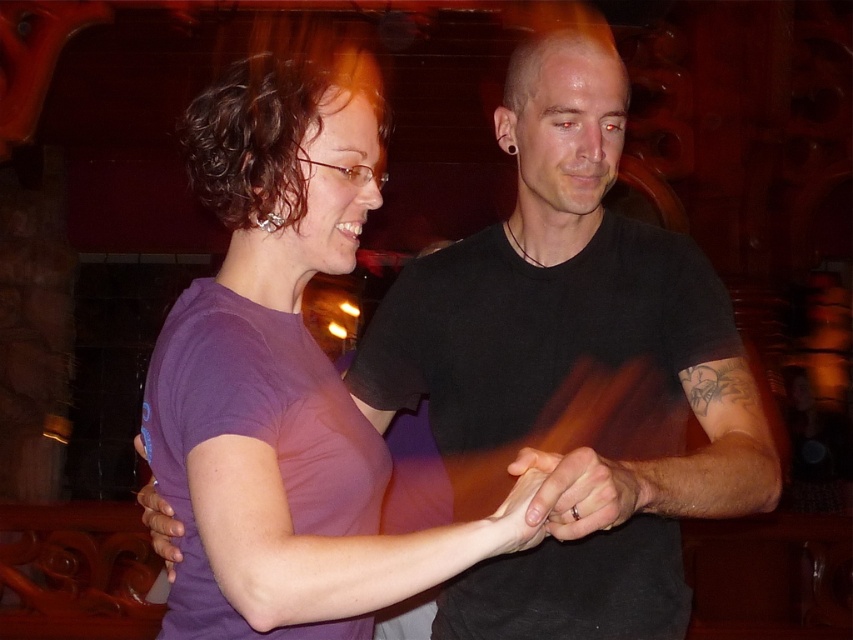
Question: Which of these objects is positioned closest to the purple matte shirt at center?

Choices:
 (A) black matte t-shirt at center
 (B) matte purple shirt at center

Answer: (B)

Question: Can you confirm if black matte t-shirt at center is bigger than purple matte hand at lower left?

Choices:
 (A) yes
 (B) no

Answer: (A)

Question: Which object is positioned farthest from the black matte t-shirt at center?

Choices:
 (A) purple matte shirt at center
 (B) matte purple shirt at center
 (C) purple matte hand at lower left
 (D) matte gold ring at center

Answer: (C)

Question: Can you confirm if purple matte shirt at center is wider than matte gold ring at center?

Choices:
 (A) no
 (B) yes

Answer: (B)

Question: Can you confirm if purple matte shirt at center is positioned to the right of matte purple shirt at center?

Choices:
 (A) no
 (B) yes

Answer: (A)

Question: Which object is the closest to the black matte t-shirt at center?

Choices:
 (A) purple matte shirt at center
 (B) matte gold ring at center

Answer: (B)